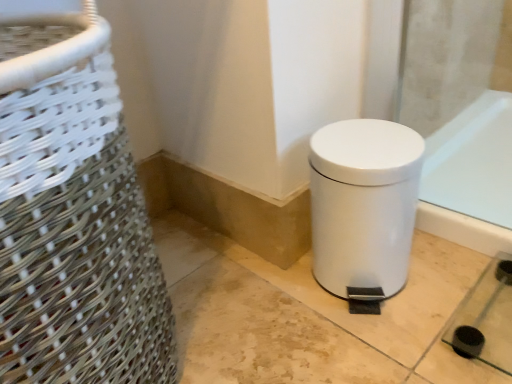
Question: Is white woven basket at left positioned beyond the bounds of white matte waste container at lower right?

Choices:
 (A) no
 (B) yes

Answer: (B)

Question: Could white matte waste container at lower right be considered to be inside white woven basket at left?

Choices:
 (A) no
 (B) yes

Answer: (A)

Question: From a real-world perspective, is white woven basket at left located beneath white matte waste container at lower right?

Choices:
 (A) yes
 (B) no

Answer: (B)

Question: Could you tell me if white woven basket at left is turned towards white matte waste container at lower right?

Choices:
 (A) yes
 (B) no

Answer: (B)

Question: Is white woven basket at left closer to the viewer compared to white matte waste container at lower right?

Choices:
 (A) yes
 (B) no

Answer: (A)

Question: Can you confirm if white woven basket at left is shorter than white matte waste container at lower right?

Choices:
 (A) yes
 (B) no

Answer: (B)

Question: Is white matte waste container at lower right at the right side of white woven basket at left?

Choices:
 (A) no
 (B) yes

Answer: (B)

Question: Considering the relative sizes of white matte waste container at lower right and white woven basket at left in the image provided, is white matte waste container at lower right smaller than white woven basket at left?

Choices:
 (A) yes
 (B) no

Answer: (A)

Question: Could you tell me if white matte waste container at lower right is facing white woven basket at left?

Choices:
 (A) no
 (B) yes

Answer: (A)

Question: Does white matte waste container at lower right come in front of white woven basket at left?

Choices:
 (A) yes
 (B) no

Answer: (B)

Question: Is white woven basket at left a part of white matte waste container at lower right?

Choices:
 (A) yes
 (B) no

Answer: (B)

Question: Can you confirm if white matte waste container at lower right is positioned to the left of white woven basket at left?

Choices:
 (A) no
 (B) yes

Answer: (A)

Question: Would you say white matte waste container at lower right is inside or outside white woven basket at left?

Choices:
 (A) inside
 (B) outside

Answer: (B)